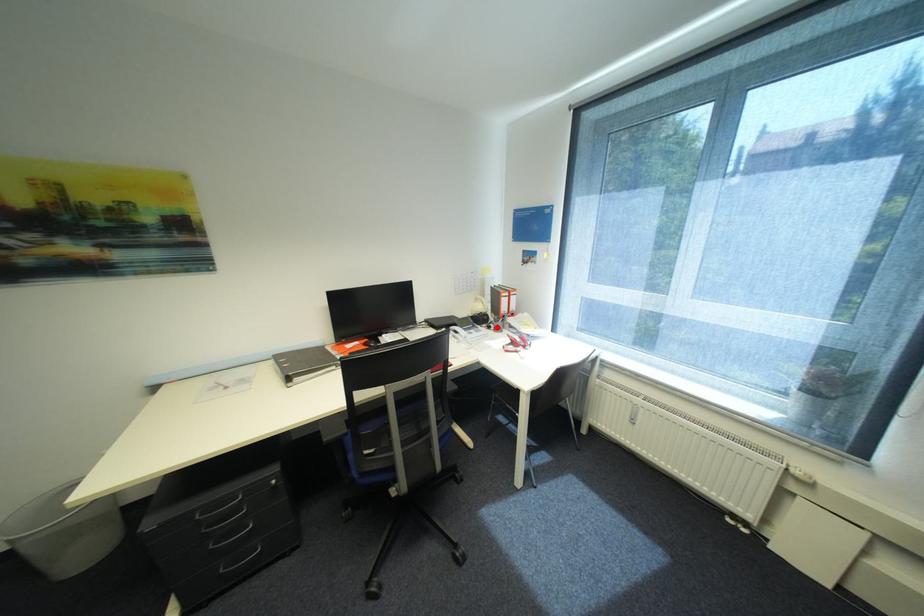
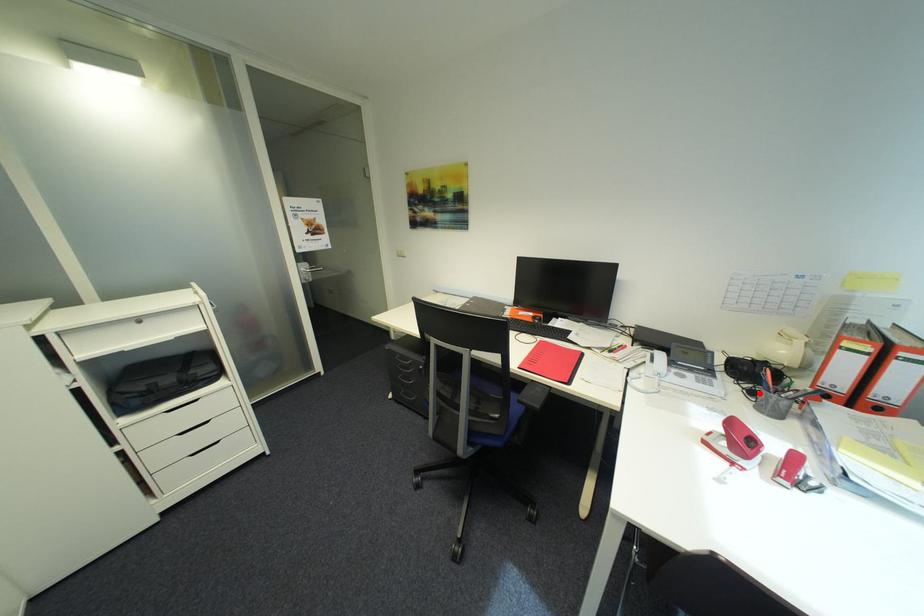
I am providing you with two images of the same scene from different viewpoints. A red point is marked on the first image and another point is marked on the second image. Is the red point in image1 aligned with the point shown in image2?

Yes